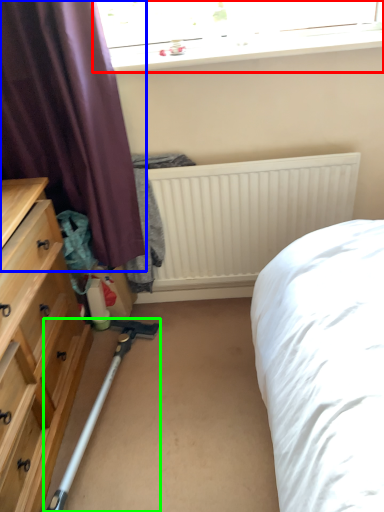
Question: Based on their relative distances, which object is nearer to window (highlighted by a red box)? Choose from curtain (highlighted by a blue box) and equipment (highlighted by a green box).

Choices:
 (A) curtain
 (B) equipment

Answer: (A)